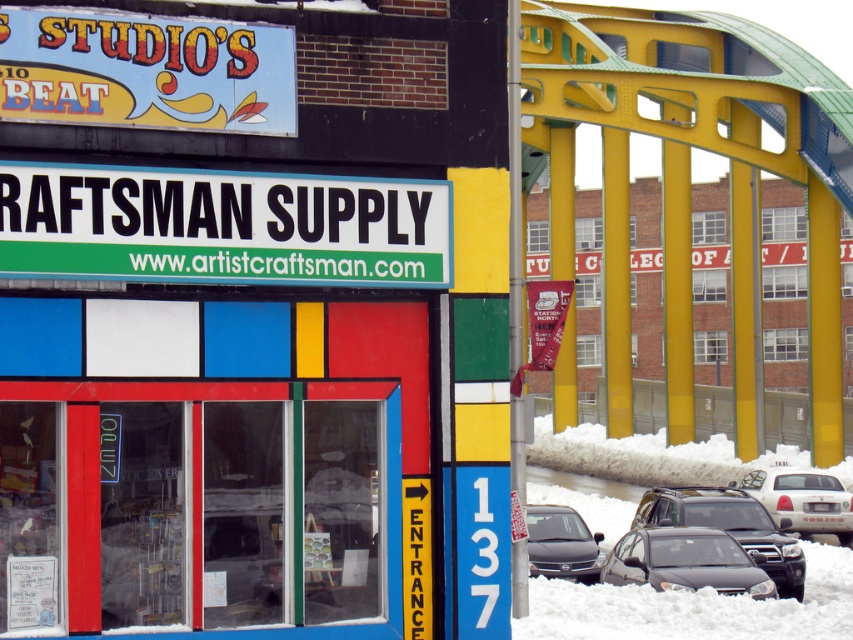
Question: Does white plastic sign at upper center have a smaller size compared to matte black suv at lower right?

Choices:
 (A) no
 (B) yes

Answer: (B)

Question: Which object appears closest to the camera in this image?

Choices:
 (A) satin black sedan at lower right
 (B) matte plastic sign at center

Answer: (B)

Question: Which object appears closest to the camera in this image?

Choices:
 (A) matte black suv at lower right
 (B) white plastic sign at upper center
 (C) satin black sedan at lower right
 (D) matte plastic sign at center

Answer: (B)

Question: Which of the following is the farthest from the observer?

Choices:
 (A) satin black sedan at lower right
 (B) matte plastic sign at center

Answer: (A)

Question: Does matte plastic sign at center appear on the left side of satin black sedan at lower center?

Choices:
 (A) yes
 (B) no

Answer: (A)

Question: Does white plastic sign at upper center appear on the left side of satin black sedan at lower center?

Choices:
 (A) no
 (B) yes

Answer: (B)